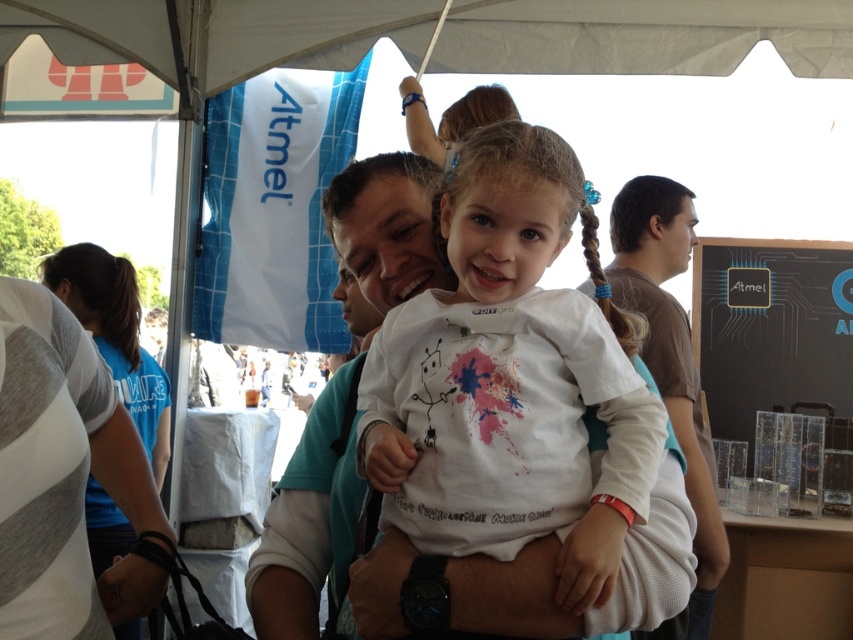
Question: Which point is closer to the camera?

Choices:
 (A) white cotton shirt at center
 (B) brown cotton t-shirt at center
 (C) blue braided hair at center
 (D) blue t-shirt at left

Answer: (A)

Question: Is white cotton shirt at center thinner than brown cotton t-shirt at center?

Choices:
 (A) yes
 (B) no

Answer: (A)

Question: Which object is the farthest from the brown cotton t-shirt at center?

Choices:
 (A) white cotton shirt at center
 (B) blue braided hair at center
 (C) blue t-shirt at left

Answer: (C)

Question: Is white cotton shirt at center to the left of blue t-shirt at left from the viewer's perspective?

Choices:
 (A) no
 (B) yes

Answer: (A)

Question: Which point appears farthest from the camera in this image?

Choices:
 (A) (543, 506)
 (B) (614, 320)

Answer: (B)

Question: Is the position of white cotton shirt at center less distant than that of blue t-shirt at left?

Choices:
 (A) yes
 (B) no

Answer: (A)